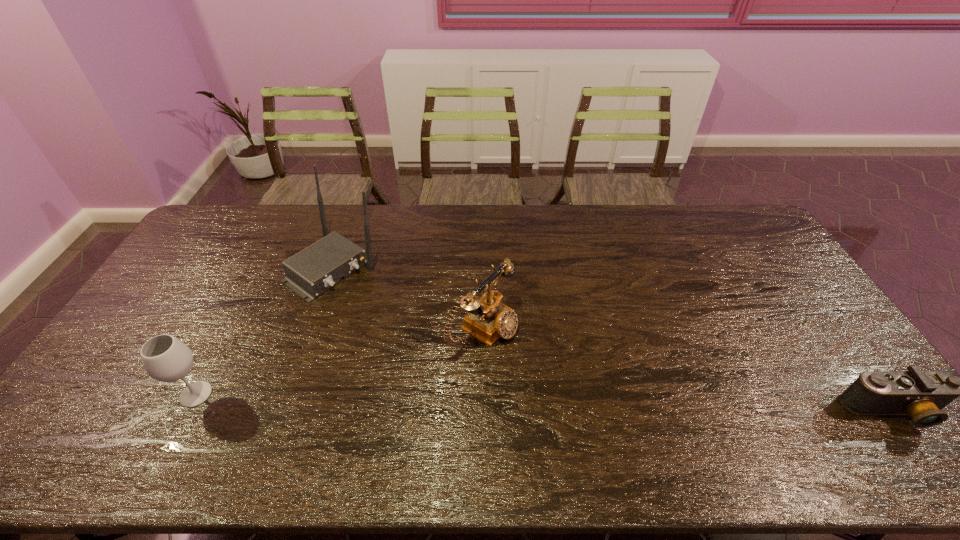
Identify the location of vacant spot on the desktop that is between the leftmost object and the rightmost object and is positioned on the back of the router to connect cables. (531, 402).

Where is `vacant space on the desktop that is between the wineglass and the shortest object and is positioned on the dial number of the second object from right to left`? The width and height of the screenshot is (960, 540). vacant space on the desktop that is between the wineglass and the shortest object and is positioned on the dial number of the second object from right to left is located at coordinates (607, 404).